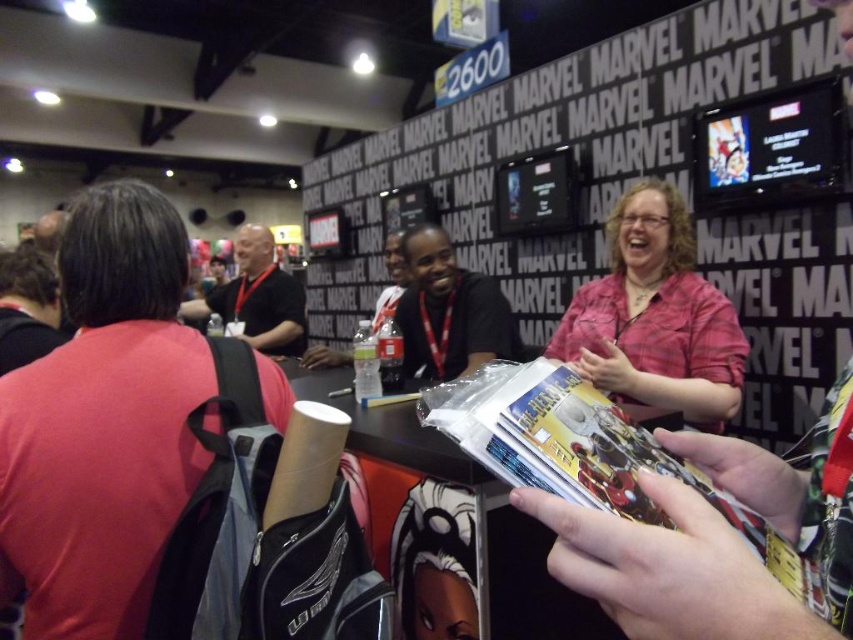
From the picture: Which is more to the right, pink plaid shirt at center or matte plastic magazine at center?

Positioned to the right is pink plaid shirt at center.

Can you confirm if pink plaid shirt at center is positioned to the right of matte plastic magazine at center?

Correct, you'll find pink plaid shirt at center to the right of matte plastic magazine at center.

Is point (646, 328) farther from viewer compared to point (757, 528)?

Yes, point (646, 328) is farther from viewer.

Identify the location of pink plaid shirt at center. (654, 316).

Identify the location of red fabric shirt at left. (103, 422).

Is point (45, 604) positioned in front of point (486, 340)?

That is True.

Where is `red fabric shirt at left`? red fabric shirt at left is located at coordinates (103, 422).

Who is taller, red fabric shirt at left or black shirt at left?

black shirt at left is taller.

Between point (123, 280) and point (215, 307), which one is positioned behind?

Point (215, 307)

In order to click on red fabric shirt at left in this screenshot , I will do click(103, 422).